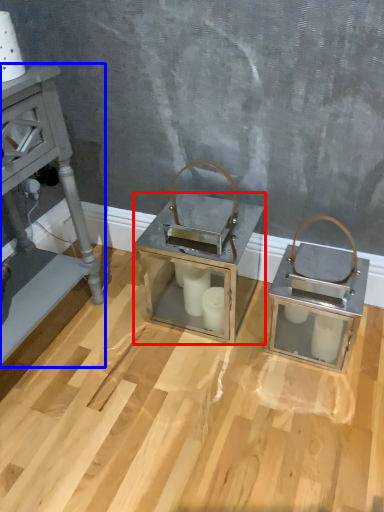
Question: Among these objects, which one is nearest to the camera, table (highlighted by a red box) or furniture (highlighted by a blue box)?

Choices:
 (A) table
 (B) furniture

Answer: (B)